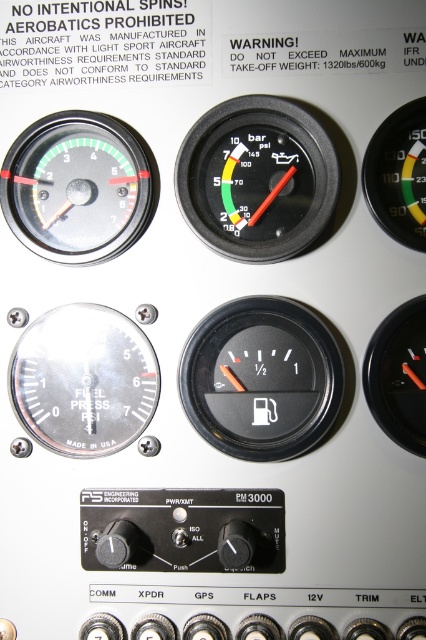
Is point (322, 371) less distant than point (365, 193)?

No, (322, 371) is further to viewer.

From the picture: Does black plastic fuel gauge at center appear on the left side of black plastic gauge at upper right?

Yes, black plastic fuel gauge at center is to the left of black plastic gauge at upper right.

Is point (313, 435) positioned after point (385, 152)?

Yes, it is behind point (385, 152).

At what (x,y) coordinates should I click in order to perform the action: click on black plastic fuel gauge at center. Please return your answer as a coordinate pair (x, y). Looking at the image, I should click on (261, 378).

Which is behind, point (324, 428) or point (203, 132)?

The point (324, 428) is more distant.

Who is shorter, black plastic fuel gauge at center or black plastic gauge at center?

Standing shorter between the two is black plastic gauge at center.

The height and width of the screenshot is (640, 426). I want to click on black plastic fuel gauge at center, so click(261, 378).

How much distance is there between black plastic fuel gauge at center and matte black fuel pressure gauge at upper left?

15.85 inches

Does black plastic fuel gauge at center have a larger size compared to matte black fuel pressure gauge at upper left?

Indeed, black plastic fuel gauge at center has a larger size compared to matte black fuel pressure gauge at upper left.

Is point (215, 394) farther from camera compared to point (143, 161)?

That is True.

I want to click on black plastic fuel gauge at center, so pyautogui.click(x=261, y=378).